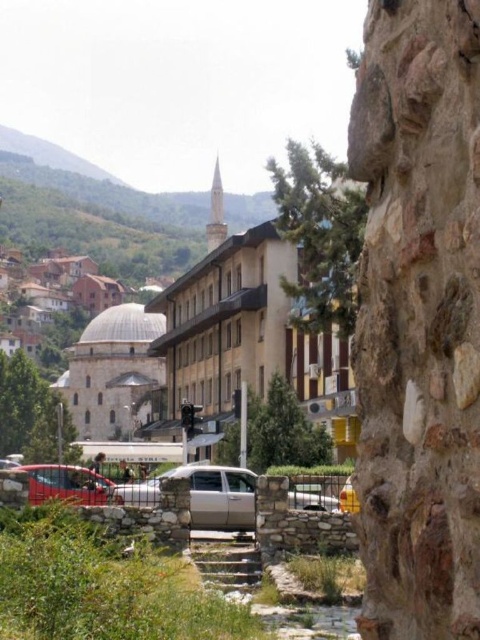
Question: Which of the following is the farthest from the observer?

Choices:
 (A) metallic silver car at lower left
 (B) beige stone mosque at center

Answer: (B)

Question: Which point is closer to the camera?

Choices:
 (A) 222,468
 (B) 192,284

Answer: (A)

Question: Does beige stone mosque at center have a smaller size compared to metallic silver car at lower left?

Choices:
 (A) no
 (B) yes

Answer: (A)

Question: Is silver metallic sedan at center wider than metallic silver car at lower left?

Choices:
 (A) yes
 (B) no

Answer: (A)

Question: Can you confirm if beige stone mosque at center is positioned below silver metallic sedan at center?

Choices:
 (A) yes
 (B) no

Answer: (B)

Question: Which point is farther from the camera taking this photo?

Choices:
 (A) (74, 467)
 (B) (251, 522)

Answer: (A)